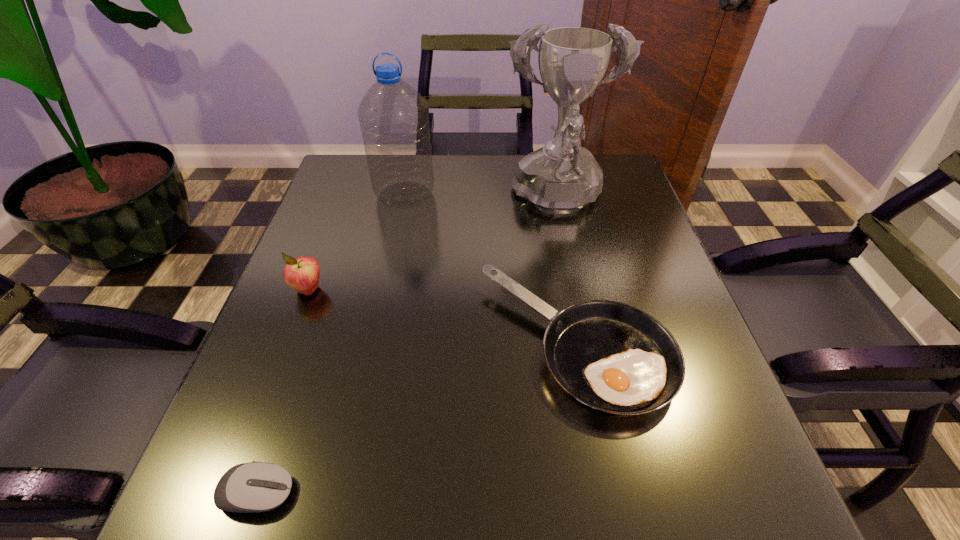
Find the location of a particular element. This screenshot has width=960, height=540. award is located at coordinates (562, 177).

Locate an element on the screen. This screenshot has width=960, height=540. water jug is located at coordinates (394, 120).

At what (x,y) coordinates should I click in order to perform the action: click on apple. Please return your answer as a coordinate pair (x, y). Image resolution: width=960 pixels, height=540 pixels. Looking at the image, I should click on (302, 274).

Find the location of a particular element. This screenshot has width=960, height=540. frying pan is located at coordinates (613, 357).

Image resolution: width=960 pixels, height=540 pixels. I want to click on computer equipment, so click(253, 487).

Identify the location of the shortest object. The width and height of the screenshot is (960, 540). [253, 487].

You are a GUI agent. You are given a task and a screenshot of the screen. Output one action in this format:
    pyautogui.click(x=<x>, y=<y>)
    Task: Click on the free space located 0.250m on the side with emblem of the award
    This screenshot has height=540, width=960.
    Given the screenshot: What is the action you would take?
    pyautogui.click(x=581, y=316)

At what (x,y) coordinates should I click in order to perform the action: click on free spot located on the front of the second tallest object. Please return your answer as a coordinate pair (x, y). Looking at the image, I should click on (391, 261).

I want to click on vacant space situated on the right of the third shortest object, so click(368, 289).

In order to click on free region located on the back of the second shortest object in this screenshot , I will do `click(551, 215)`.